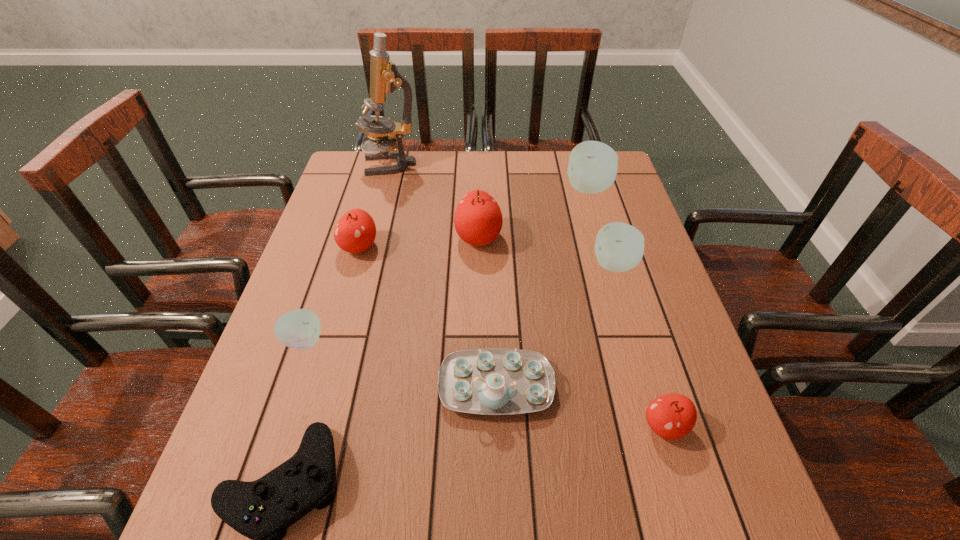
Locate an element on the screen. the smallest red apple is located at coordinates (672, 416).

The height and width of the screenshot is (540, 960). What are the coordinates of `the nearest apple` in the screenshot? It's located at (672, 416).

Where is `free spot located 0.230m on the front of the tallest object`? The height and width of the screenshot is (540, 960). free spot located 0.230m on the front of the tallest object is located at coordinates (376, 221).

This screenshot has height=540, width=960. I want to click on free space located 0.120m on the back of the biggest white apple, so click(579, 156).

I want to click on free space located 0.260m on the right of the biggest red apple, so click(596, 238).

You are a GUI agent. You are given a task and a screenshot of the screen. Output one action in this format:
    pyautogui.click(x=<x>, y=<y>)
    Task: Click on the free space located on the front of the second smallest white apple
    The width and height of the screenshot is (960, 540).
    Given the screenshot: What is the action you would take?
    pyautogui.click(x=651, y=384)

Identify the location of vacant space located on the right of the second biggest red apple. The image size is (960, 540). (464, 247).

Identify the location of vacant space located on the back of the chinaware. (494, 315).

At what (x,y) coordinates should I click in order to perform the action: click on vacant space located on the front of the leftmost white apple. Please return your answer as a coordinate pair (x, y). This screenshot has width=960, height=540. Looking at the image, I should click on (257, 480).

Locate an element on the screen. free location located on the back of the rightmost red apple is located at coordinates (642, 355).